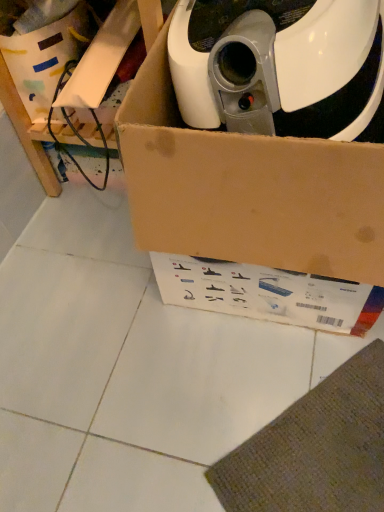
Question: Can you confirm if white cardboard box at upper left is positioned to the left of brown cardboard box at upper left?

Choices:
 (A) yes
 (B) no

Answer: (A)

Question: Does white cardboard box at upper left have a lesser height compared to brown cardboard box at upper left?

Choices:
 (A) no
 (B) yes

Answer: (B)

Question: Is white cardboard box at upper left further to camera compared to brown cardboard box at upper left?

Choices:
 (A) yes
 (B) no

Answer: (A)

Question: Would you say white cardboard box at upper left contains brown cardboard box at upper left?

Choices:
 (A) no
 (B) yes

Answer: (A)

Question: Is white cardboard box at upper left facing towards brown cardboard box at upper left?

Choices:
 (A) no
 (B) yes

Answer: (B)

Question: Relative to brown cardboard box at upper center, is white cardboard box at upper left in front or behind?

Choices:
 (A) front
 (B) behind

Answer: (B)

Question: From the image's perspective, is white cardboard box at upper left above or below brown cardboard box at upper center?

Choices:
 (A) above
 (B) below

Answer: (A)

Question: From a real-world perspective, relative to brown cardboard box at upper center, is white cardboard box at upper left vertically above or below?

Choices:
 (A) below
 (B) above

Answer: (A)

Question: Visually, is white cardboard box at upper left positioned to the left or to the right of brown cardboard box at upper center?

Choices:
 (A) right
 (B) left

Answer: (B)

Question: Considering the positions of brown cardboard box at upper center and white cardboard box at upper left in the image, is brown cardboard box at upper center wider or thinner than white cardboard box at upper left?

Choices:
 (A) wide
 (B) thin

Answer: (A)

Question: From the image's perspective, is brown cardboard box at upper center positioned above or below white cardboard box at upper left?

Choices:
 (A) above
 (B) below

Answer: (B)

Question: In terms of height, does brown cardboard box at upper center look taller or shorter compared to white cardboard box at upper left?

Choices:
 (A) tall
 (B) short

Answer: (A)

Question: Which is correct: brown cardboard box at upper center is inside white cardboard box at upper left, or outside of it?

Choices:
 (A) inside
 (B) outside

Answer: (B)

Question: In the image, is brown cardboard box at upper left positioned in front of or behind brown cardboard box at upper center?

Choices:
 (A) behind
 (B) front

Answer: (A)

Question: Visually, is brown cardboard box at upper left positioned to the left or to the right of brown cardboard box at upper center?

Choices:
 (A) right
 (B) left

Answer: (B)